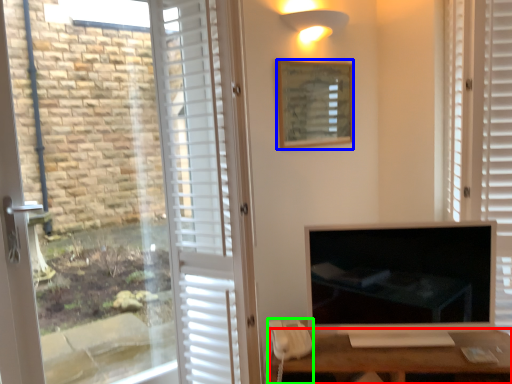
Question: Which object is the closest to the desk (highlighted by a red box)? Choose among these: picture frame (highlighted by a blue box) or corded phone (highlighted by a green box).

Choices:
 (A) picture frame
 (B) corded phone

Answer: (B)